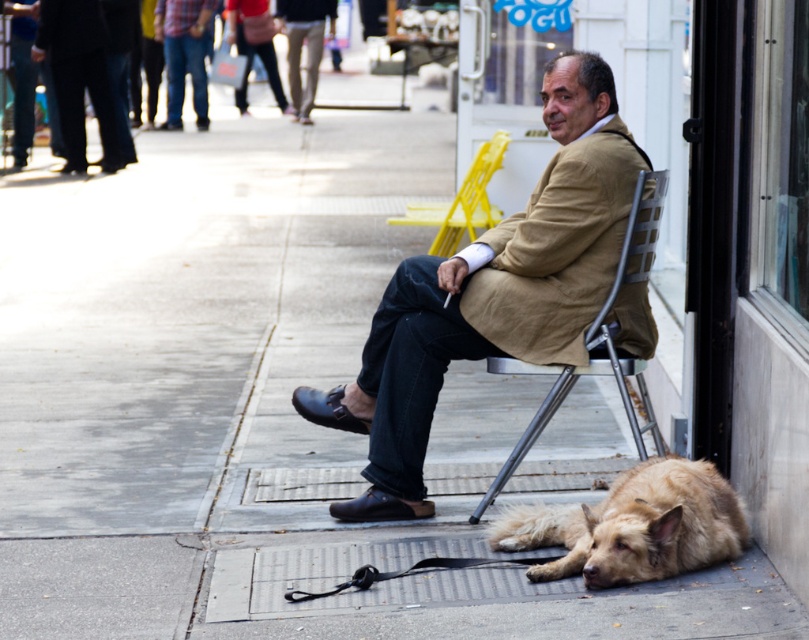
Is brown leather jacket at center shorter than fuzzy brown fur at lower right?

In fact, brown leather jacket at center may be taller than fuzzy brown fur at lower right.

Measure the distance between point (572, 260) and camera.

6.00 meters

I want to click on brown leather jacket at center, so click(x=490, y=292).

Does fuzzy brown fur at lower right come behind metallic silver folding chair at center?

No, fuzzy brown fur at lower right is closer to the viewer.

Is point (695, 531) less distant than point (640, 179)?

Yes.

This screenshot has width=809, height=640. Find the location of `fuzzy brown fur at lower right`. fuzzy brown fur at lower right is located at coordinates (633, 525).

Which of these two, metallic silver folding chair at center or yellow plastic chair at center, stands shorter?

With less height is yellow plastic chair at center.

Who is more distant from viewer, (659, 193) or (434, 221)?

Point (434, 221)

In order to click on metallic silver folding chair at center in this screenshot , I will do `click(596, 339)`.